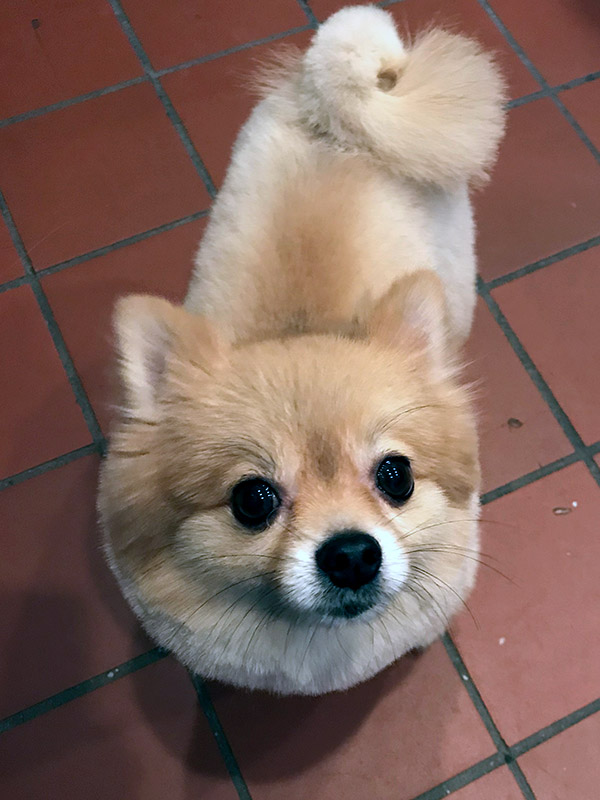
This screenshot has height=800, width=600. I want to click on square tile, so click(x=82, y=654).